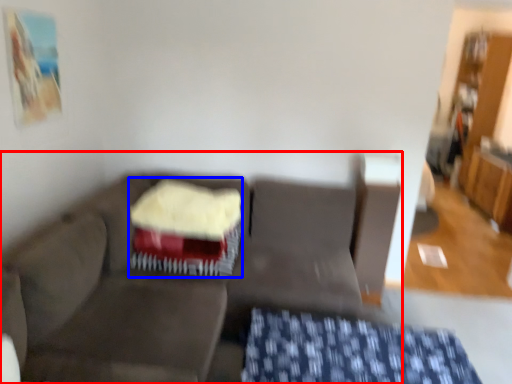
Question: Which object is further to the camera taking this photo, studio couch (highlighted by a red box) or cake (highlighted by a blue box)?

Choices:
 (A) studio couch
 (B) cake

Answer: (B)